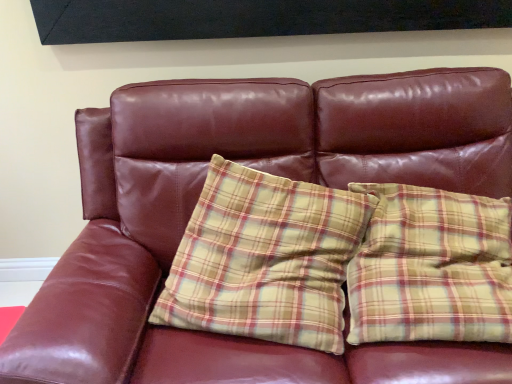
The height and width of the screenshot is (384, 512). Describe the element at coordinates (431, 267) in the screenshot. I see `yellow plaid pillow at right, which is the second pillow in left-to-right order` at that location.

At what (x,y) coordinates should I click in order to perform the action: click on yellow plaid pillow at right, positioned as the 1th pillow in right-to-left order. Please return your answer as a coordinate pair (x, y). The image size is (512, 384). Looking at the image, I should click on (431, 267).

Measure the distance between yellow plaid pillow at center, acting as the second pillow starting from the right, and camera.

A distance of 3.57 feet exists between yellow plaid pillow at center, acting as the second pillow starting from the right, and camera.

This screenshot has width=512, height=384. What do you see at coordinates (265, 259) in the screenshot?
I see `yellow plaid pillow at center, placed as the 1th pillow when sorted from left to right` at bounding box center [265, 259].

Measure the distance between point (282,276) and camera.

1.19 meters.

This screenshot has height=384, width=512. What are the coordinates of `yellow plaid pillow at center, placed as the 1th pillow when sorted from left to right` in the screenshot? It's located at (265, 259).

You are a GUI agent. You are given a task and a screenshot of the screen. Output one action in this format:
    pyautogui.click(x=<x>, y=<y>)
    Task: Click on the yellow plaid pillow at right, which is the second pillow in left-to-right order
    The height and width of the screenshot is (384, 512).
    Given the screenshot: What is the action you would take?
    click(431, 267)

Considering the relative positions of yellow plaid pillow at right, positioned as the 1th pillow in right-to-left order, and yellow plaid pillow at center, acting as the second pillow starting from the right, in the image provided, is yellow plaid pillow at right, positioned as the 1th pillow in right-to-left order, to the right of yellow plaid pillow at center, acting as the second pillow starting from the right, from the viewer's perspective?

Yes.

Is yellow plaid pillow at right, positioned as the 1th pillow in right-to-left order, further to the viewer compared to yellow plaid pillow at center, acting as the second pillow starting from the right?

No, the depth of yellow plaid pillow at right, positioned as the 1th pillow in right-to-left order, is less than that of yellow plaid pillow at center, acting as the second pillow starting from the right.

Does point (485, 274) come farther from viewer compared to point (340, 330)?

Yes.

From the image's perspective, which is below, yellow plaid pillow at right, which is the second pillow in left-to-right order, or yellow plaid pillow at center, acting as the second pillow starting from the right?

From the image's view, yellow plaid pillow at center, acting as the second pillow starting from the right, is below.

From a real-world perspective, is yellow plaid pillow at right, which is the second pillow in left-to-right order, physically located above or below yellow plaid pillow at center, placed as the 1th pillow when sorted from left to right?

In terms of real-world spatial position, yellow plaid pillow at right, which is the second pillow in left-to-right order, is above yellow plaid pillow at center, placed as the 1th pillow when sorted from left to right.

Looking at this image, considering the relative sizes of yellow plaid pillow at right, which is the second pillow in left-to-right order, and yellow plaid pillow at center, placed as the 1th pillow when sorted from left to right, in the image provided, is yellow plaid pillow at right, which is the second pillow in left-to-right order, thinner than yellow plaid pillow at center, placed as the 1th pillow when sorted from left to right,?

Indeed, yellow plaid pillow at right, which is the second pillow in left-to-right order, has a lesser width compared to yellow plaid pillow at center, placed as the 1th pillow when sorted from left to right.

Is yellow plaid pillow at right, which is the second pillow in left-to-right order, shorter than yellow plaid pillow at center, acting as the second pillow starting from the right?

Yes, yellow plaid pillow at right, which is the second pillow in left-to-right order, is shorter than yellow plaid pillow at center, acting as the second pillow starting from the right.

Does yellow plaid pillow at right, which is the second pillow in left-to-right order, have a smaller size compared to yellow plaid pillow at center, placed as the 1th pillow when sorted from left to right?

Yes, yellow plaid pillow at right, which is the second pillow in left-to-right order, is smaller than yellow plaid pillow at center, placed as the 1th pillow when sorted from left to right.

Choose the correct answer: Is yellow plaid pillow at right, which is the second pillow in left-to-right order, inside yellow plaid pillow at center, placed as the 1th pillow when sorted from left to right, or outside it?

yellow plaid pillow at right, which is the second pillow in left-to-right order, is not inside yellow plaid pillow at center, placed as the 1th pillow when sorted from left to right, it's outside.

Is yellow plaid pillow at right, positioned as the 1th pillow in right-to-left order, not close to yellow plaid pillow at center, placed as the 1th pillow when sorted from left to right?

That's not correct — yellow plaid pillow at right, positioned as the 1th pillow in right-to-left order, is a little close to yellow plaid pillow at center, placed as the 1th pillow when sorted from left to right.

Is yellow plaid pillow at right, which is the second pillow in left-to-right order, oriented away from yellow plaid pillow at center, acting as the second pillow starting from the right?

No.

Identify the location of pillow above the yellow plaid pillow at center, acting as the second pillow starting from the right (from the image's perspective). (431, 267).

Which is more to the left, yellow plaid pillow at center, acting as the second pillow starting from the right, or yellow plaid pillow at right, which is the second pillow in left-to-right order?

yellow plaid pillow at center, acting as the second pillow starting from the right, is more to the left.

Is yellow plaid pillow at center, acting as the second pillow starting from the right, behind yellow plaid pillow at right, positioned as the 1th pillow in right-to-left order?

Yes, it is behind yellow plaid pillow at right, positioned as the 1th pillow in right-to-left order.

Is point (305, 199) positioned after point (381, 222)?

Yes.

From the image's perspective, between yellow plaid pillow at center, acting as the second pillow starting from the right, and yellow plaid pillow at right, positioned as the 1th pillow in right-to-left order, which one is located above?

From the image's view, yellow plaid pillow at right, positioned as the 1th pillow in right-to-left order, is above.

From the picture: From a real-world perspective, is yellow plaid pillow at center, acting as the second pillow starting from the right, positioned under yellow plaid pillow at right, positioned as the 1th pillow in right-to-left order, based on gravity?

Yes, from a real-world perspective, yellow plaid pillow at center, acting as the second pillow starting from the right, is under yellow plaid pillow at right, positioned as the 1th pillow in right-to-left order.

Considering the sizes of yellow plaid pillow at center, placed as the 1th pillow when sorted from left to right, and yellow plaid pillow at right, positioned as the 1th pillow in right-to-left order, in the image, is yellow plaid pillow at center, placed as the 1th pillow when sorted from left to right, wider or thinner than yellow plaid pillow at right, positioned as the 1th pillow in right-to-left order,?

In the image, yellow plaid pillow at center, placed as the 1th pillow when sorted from left to right, appears to be wider than yellow plaid pillow at right, positioned as the 1th pillow in right-to-left order.

Between yellow plaid pillow at center, acting as the second pillow starting from the right, and yellow plaid pillow at right, which is the second pillow in left-to-right order, which one has less height?

yellow plaid pillow at right, which is the second pillow in left-to-right order.

Between yellow plaid pillow at center, placed as the 1th pillow when sorted from left to right, and yellow plaid pillow at right, which is the second pillow in left-to-right order, which one has larger size?

yellow plaid pillow at center, placed as the 1th pillow when sorted from left to right.

Would you say yellow plaid pillow at center, acting as the second pillow starting from the right, contains yellow plaid pillow at right, positioned as the 1th pillow in right-to-left order?

Definitely not — yellow plaid pillow at right, positioned as the 1th pillow in right-to-left order, is not inside yellow plaid pillow at center, acting as the second pillow starting from the right.

Is yellow plaid pillow at center, acting as the second pillow starting from the right, next to yellow plaid pillow at right, positioned as the 1th pillow in right-to-left order?

yellow plaid pillow at center, acting as the second pillow starting from the right, is not next to yellow plaid pillow at right, positioned as the 1th pillow in right-to-left order, and they're not touching.

Does yellow plaid pillow at center, acting as the second pillow starting from the right, turn towards yellow plaid pillow at right, positioned as the 1th pillow in right-to-left order?

No, yellow plaid pillow at center, acting as the second pillow starting from the right, is not turned towards yellow plaid pillow at right, positioned as the 1th pillow in right-to-left order.

How different are the orientations of yellow plaid pillow at center, placed as the 1th pillow when sorted from left to right, and yellow plaid pillow at right, which is the second pillow in left-to-right order, in degrees?

yellow plaid pillow at center, placed as the 1th pillow when sorted from left to right, and yellow plaid pillow at right, which is the second pillow in left-to-right order, are facing 0.000882 degrees away from each other.

Measure the distance from yellow plaid pillow at center, acting as the second pillow starting from the right, to yellow plaid pillow at right, which is the second pillow in left-to-right order.

yellow plaid pillow at center, acting as the second pillow starting from the right, is 9.33 inches from yellow plaid pillow at right, which is the second pillow in left-to-right order.

This screenshot has height=384, width=512. I want to click on pillow located in front of the yellow plaid pillow at center, placed as the 1th pillow when sorted from left to right, so click(x=431, y=267).

The height and width of the screenshot is (384, 512). Identify the location of pillow on the right of the yellow plaid pillow at center, placed as the 1th pillow when sorted from left to right. (431, 267).

At what (x,y) coordinates should I click in order to perform the action: click on pillow that is behind the yellow plaid pillow at right, positioned as the 1th pillow in right-to-left order. Please return your answer as a coordinate pair (x, y). The height and width of the screenshot is (384, 512). Looking at the image, I should click on (265, 259).